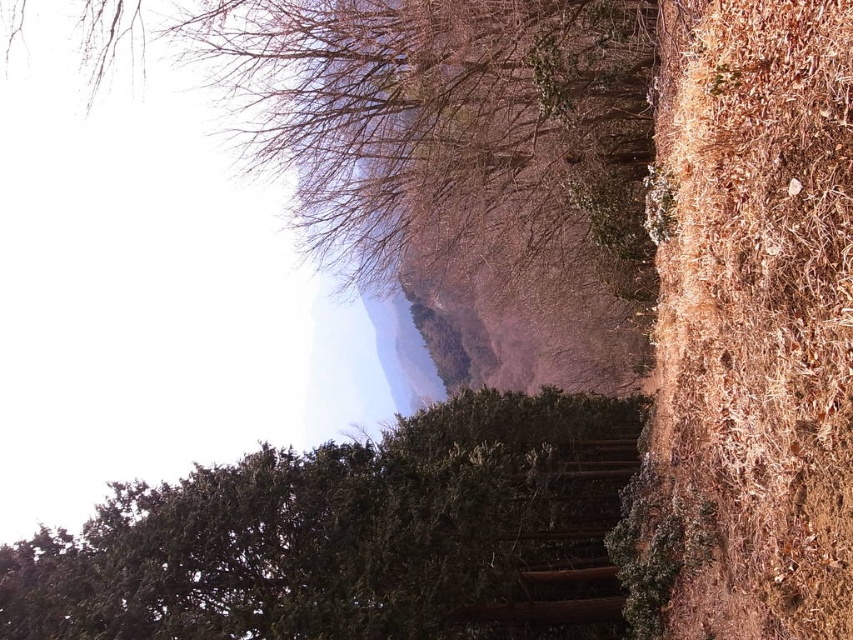
Who is positioned more to the right, brown textured tree at upper center or brown wooden stairs at center?

From the viewer's perspective, brown wooden stairs at center appears more on the right side.

Who is higher up, brown textured tree at upper center or brown wooden stairs at center?

brown textured tree at upper center is higher up.

Is point (550, 211) more distant than point (483, 614)?

That is True.

I want to click on brown textured tree at upper center, so click(x=450, y=124).

Does point (115, 515) come farther from viewer compared to point (605, 573)?

No, it is in front of (605, 573).

Between green textured tree at center and brown wooden stairs at center, which one is positioned higher?

green textured tree at center is above.

Is point (65, 588) positioned in front of point (486, 620)?

Yes, point (65, 588) is closer to viewer.

This screenshot has width=853, height=640. Identify the location of green textured tree at center. (357, 536).

Is green textured tree at center bigger than brown textured tree at upper center?

Indeed, green textured tree at center has a larger size compared to brown textured tree at upper center.

Between green textured tree at center and brown textured tree at upper center, which one appears on the right side from the viewer's perspective?

green textured tree at center

Does point (235, 515) come in front of point (241, 6)?

Yes, it is.

This screenshot has width=853, height=640. In order to click on green textured tree at center in this screenshot , I will do `click(357, 536)`.